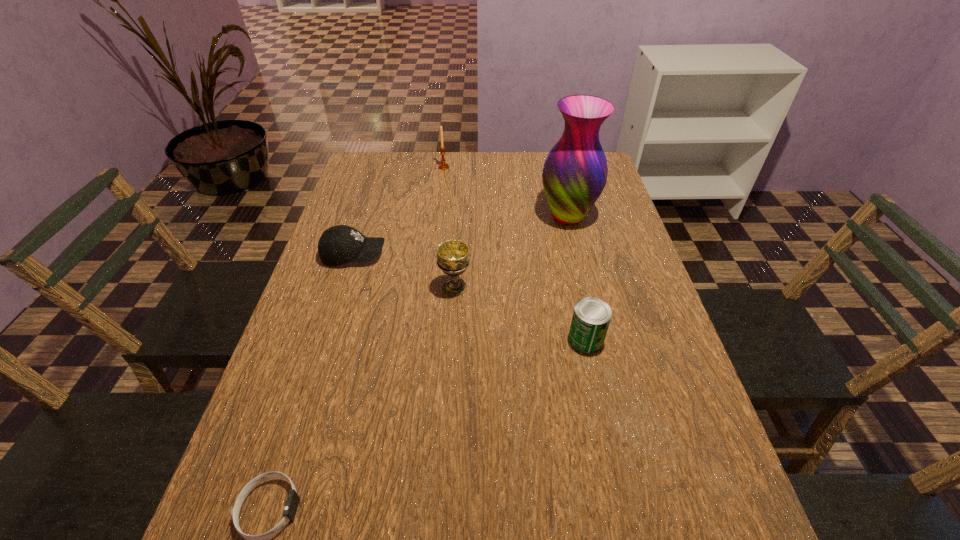
Where is `vase`? vase is located at coordinates (574, 175).

Locate an element on the screen. Image resolution: width=960 pixels, height=540 pixels. the second farthest object is located at coordinates (574, 175).

Identify the location of candle_holder. Image resolution: width=960 pixels, height=540 pixels. (443, 166).

Identify the location of the fourth object from right to left. (443, 166).

This screenshot has width=960, height=540. Find the location of `the fourth farthest object`. the fourth farthest object is located at coordinates (453, 259).

At what (x,y) coordinates should I click in order to perform the action: click on the fourth shortest object. Please return your answer as a coordinate pair (x, y). Image resolution: width=960 pixels, height=540 pixels. Looking at the image, I should click on (453, 259).

Image resolution: width=960 pixels, height=540 pixels. In order to click on can in this screenshot , I will do `click(591, 317)`.

Locate an element on the screen. This screenshot has height=540, width=960. baseball cap is located at coordinates (338, 245).

Image resolution: width=960 pixels, height=540 pixels. In order to click on vacant space located 0.150m on the back of the vase in this screenshot , I will do `click(558, 174)`.

Locate an element on the screen. The height and width of the screenshot is (540, 960). vacant point located 0.210m on the front of the farthest object is located at coordinates (440, 204).